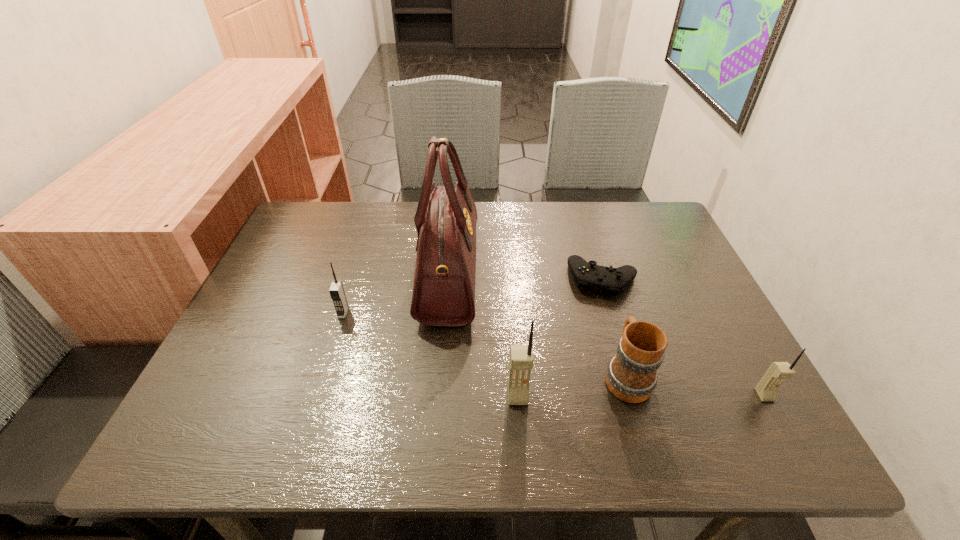
Identify the location of vacant space that satisfies the following two spatial constraints: 1. on the front-facing side of the fifth object from right to left; 2. on the left side of the shortest object. (448, 279).

In order to click on vacant space that satisfies the following two spatial constraints: 1. on the front-facing side of the tallest object; 2. on the side of the mug with the handle in this screenshot , I will do `click(441, 375)`.

Identify the location of free space that satisfies the following two spatial constraints: 1. on the side of the shortest object with the handle; 2. on the right side of the mug. (598, 279).

Where is `vacant space that satisfies the following two spatial constraints: 1. on the front-facing side of the handbag; 2. on the front-facing side of the farthest cellular telephone`? The height and width of the screenshot is (540, 960). vacant space that satisfies the following two spatial constraints: 1. on the front-facing side of the handbag; 2. on the front-facing side of the farthest cellular telephone is located at coordinates (445, 313).